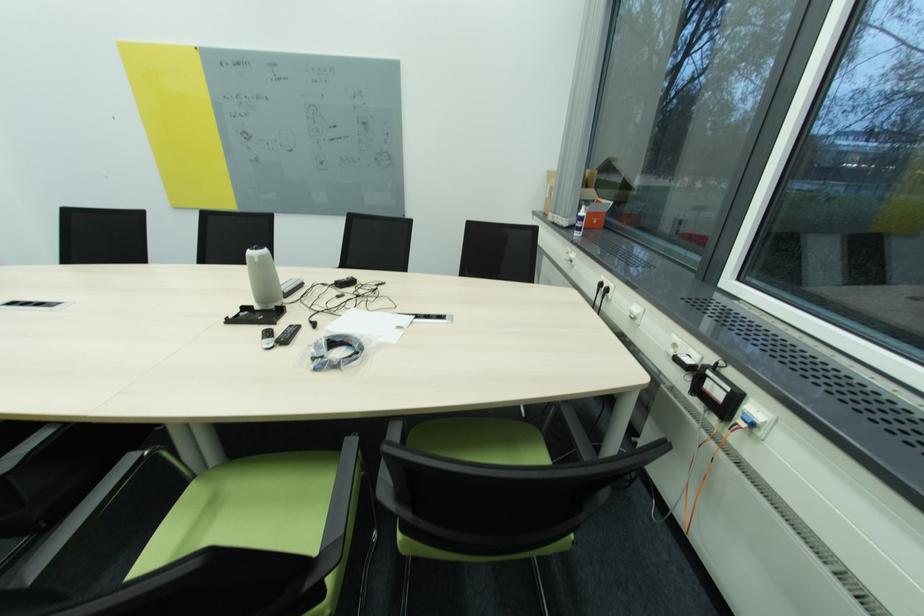
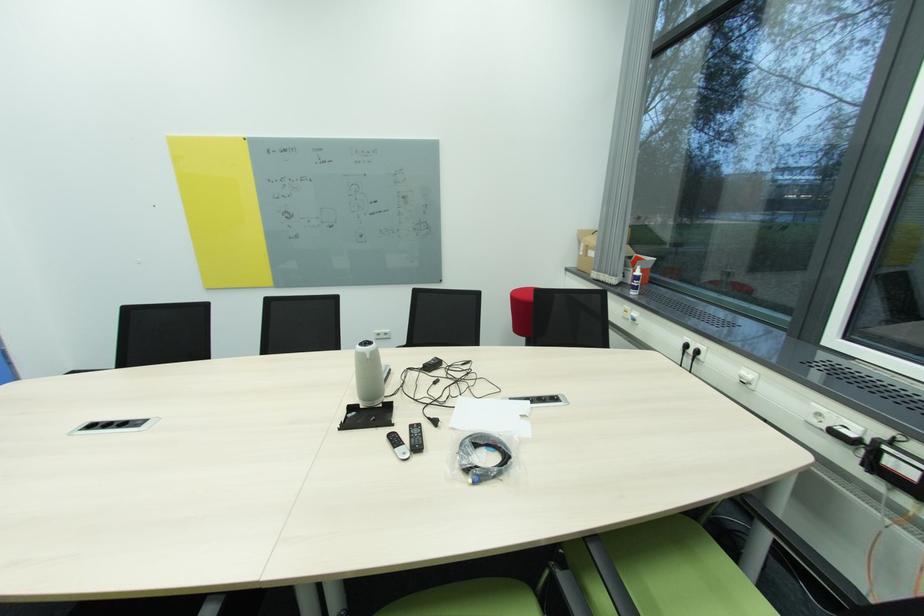
The point at (273,345) is marked in the first image. Where is the corresponding point in the second image?

(408, 455)